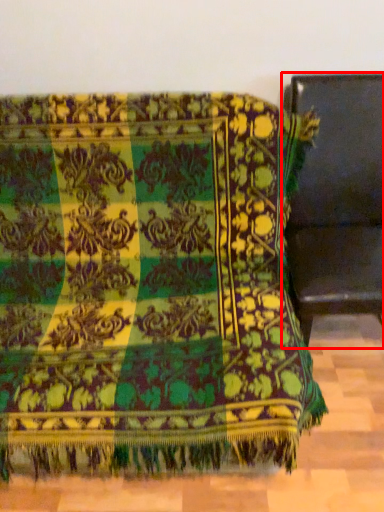
Question: From the image's perspective, where is furniture (annotated by the red box) located relative to furniture?

Choices:
 (A) above
 (B) below

Answer: (A)